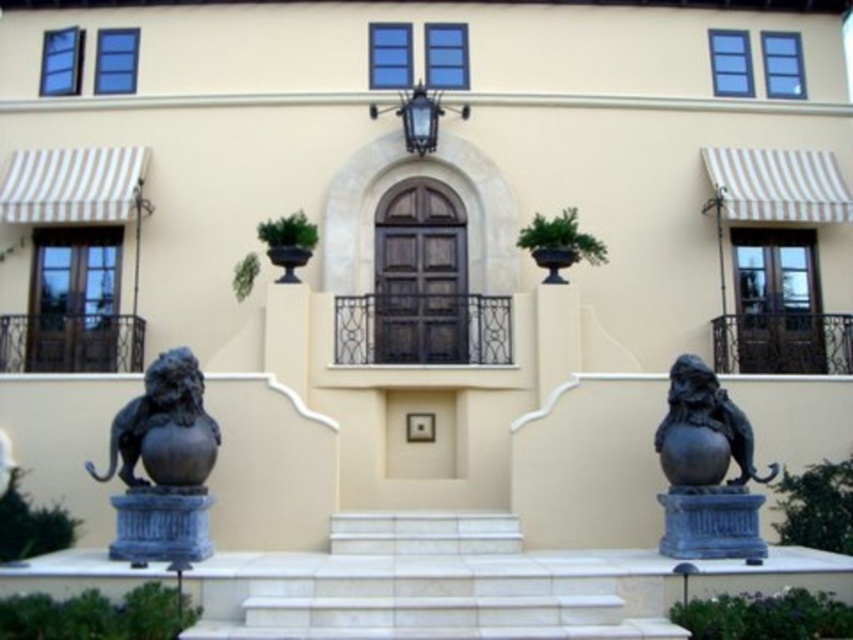
Can you confirm if white marble stairs at center is positioned below black polished stone lion at right?

Correct, white marble stairs at center is located below black polished stone lion at right.

Which is behind, point (372, 586) or point (718, 438)?

Positioned behind is point (718, 438).

Between point (527, 563) and point (677, 355), which one is positioned in front?

Point (527, 563)

I want to click on white marble stairs at center, so click(428, 586).

Which is more to the right, white marble stairs at center or bronze lion at left?

Positioned to the right is white marble stairs at center.

Is point (415, 604) less distant than point (184, 528)?

Yes, point (415, 604) is in front of point (184, 528).

Between point (625, 589) and point (178, 436), which one is positioned in front?

Point (625, 589) is in front.

Where is `white marble stairs at center`? Image resolution: width=853 pixels, height=640 pixels. white marble stairs at center is located at coordinates (428, 586).

Which is more to the right, bronze lion at left or black polished stone lion at right?

black polished stone lion at right

Measure the distance between point (119, 528) and camera.

Point (119, 528) is 13.98 meters from camera.

This screenshot has height=640, width=853. I want to click on bronze lion at left, so click(163, 464).

You are a GUI agent. You are given a task and a screenshot of the screen. Output one action in this format:
    pyautogui.click(x=<x>, y=<y>)
    Task: Click on the bronze lion at left
    
    Given the screenshot: What is the action you would take?
    pyautogui.click(x=163, y=464)